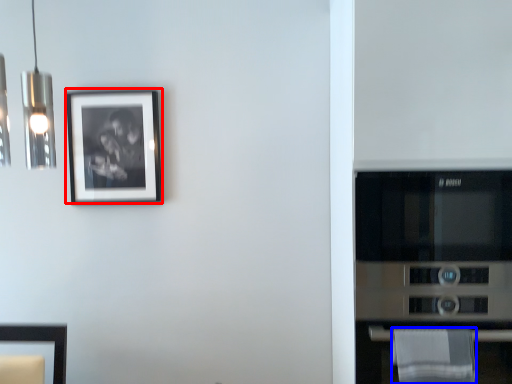
Question: Which object is further to the camera taking this photo, picture frame (highlighted by a red box) or cloth (highlighted by a blue box)?

Choices:
 (A) picture frame
 (B) cloth

Answer: (A)